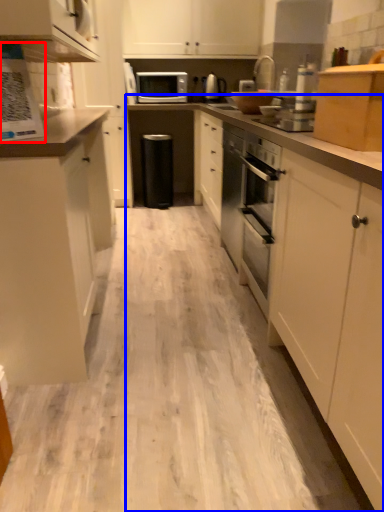
Question: Which point is closer to the camera, kitchen appliance (highlighted by a red box) or countertop (highlighted by a blue box)?

Choices:
 (A) kitchen appliance
 (B) countertop

Answer: (B)